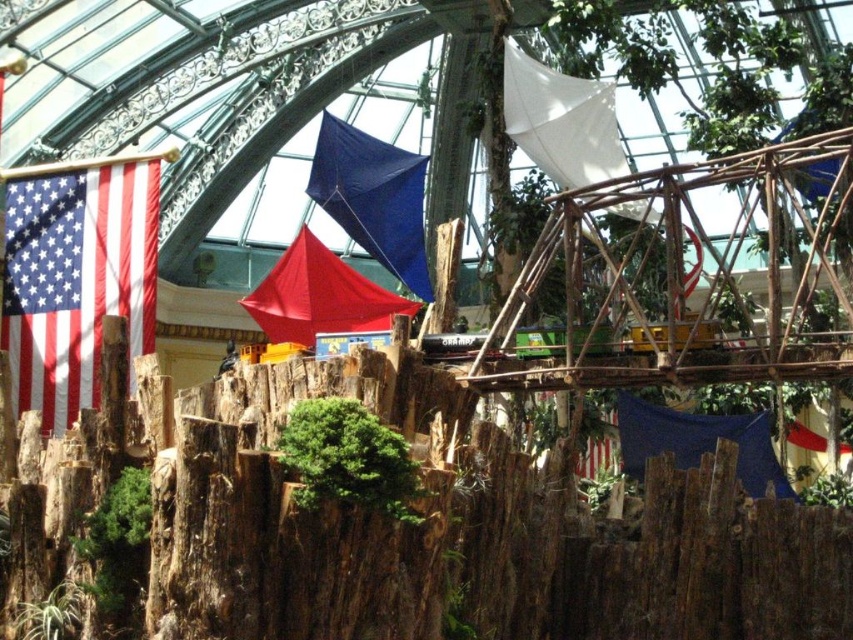
Between point (341, 145) and point (311, 252), which one is positioned behind?

The point (341, 145) is behind.

Is point (321, 202) behind point (331, 328)?

Yes.

Locate an element on the screen. This screenshot has height=640, width=853. blue fabric kite at center is located at coordinates (373, 198).

Is point (61, 412) positioned in front of point (691, 452)?

No, (61, 412) is further to viewer.

Between matte fabric flag at left and blue fabric flag at upper center, which one appears on the left side from the viewer's perspective?

Positioned to the left is matte fabric flag at left.

Does point (33, 177) come closer to viewer compared to point (791, 496)?

No, (33, 177) is further to viewer.

This screenshot has height=640, width=853. Identify the location of matte fabric flag at left. (76, 278).

Does white fabric flag at upper center have a smaller size compared to matte red tent at center?

Indeed, white fabric flag at upper center has a smaller size compared to matte red tent at center.

In the scene shown: Can you confirm if white fabric flag at upper center is wider than matte red tent at center?

No.

Identify the location of white fabric flag at upper center. The image size is (853, 640). (561, 122).